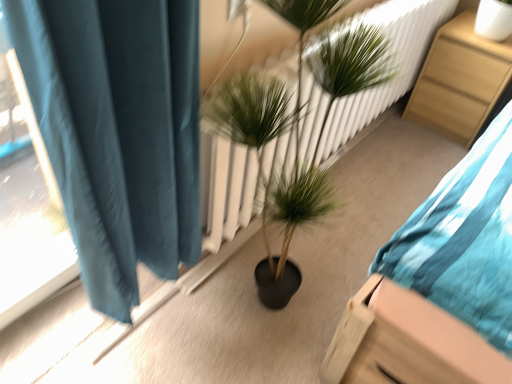
This screenshot has height=384, width=512. I want to click on free space in front of wooden nightstand at right, so click(x=428, y=150).